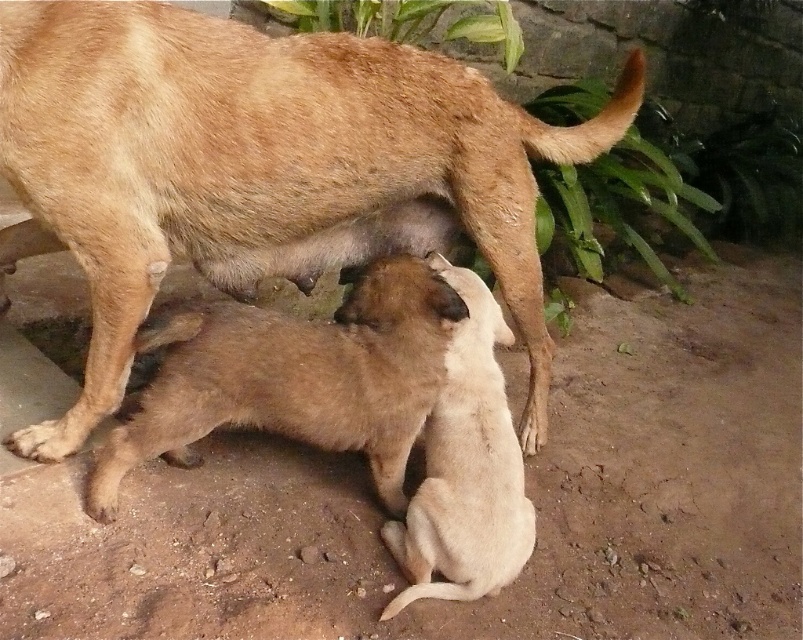
Looking at the scene of the mother dog and her puppies, which object is taller between the brown fur dog at center and the brown furry pup at center?

The brown fur dog at center is taller than the brown furry pup at center.

You are a veterinarian examining a litter of newborn puppies. You need to check the distance between the brown furry pup at center and the light brown fur at center. Is the distance more than 9 inches?

The brown furry pup at center and the light brown fur at center are 9.11 inches apart from each other, so yes, the distance is more than 9 inches.